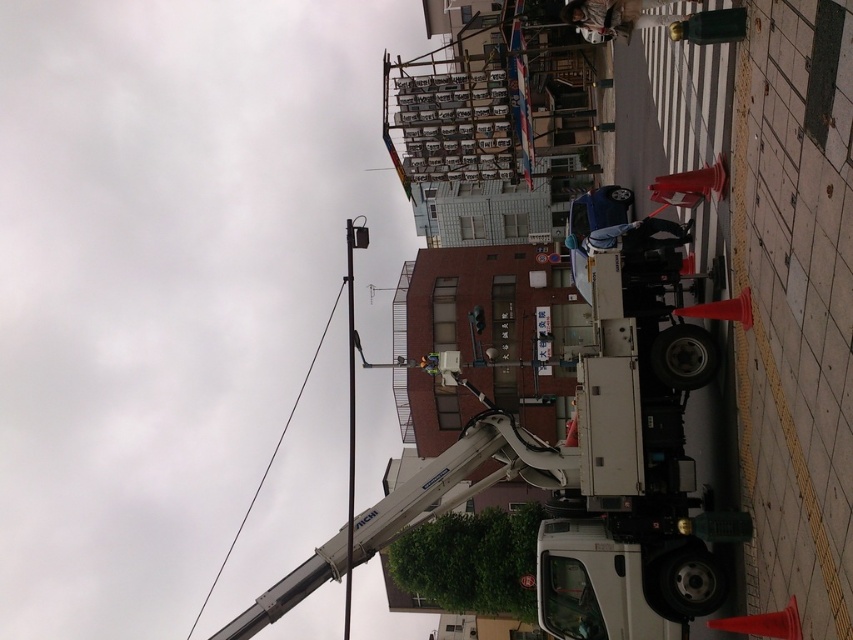
You are standing on the sidewalk and see two points marked on the image. The first point is at coordinates point (345, 634) and the second point is at point (306, 371). Which point is closer to you?

Point (306, 371) is closer to you because it is less further to the camera than point (345, 634).

You are a city planner reviewing this street layout. The brushed metal pole at upper center and the metallic wire at upper center are both present in the scene. Which object is located above the other?

The brushed metal pole at upper center is positioned over the metallic wire at upper center, so the pole is above the wire.